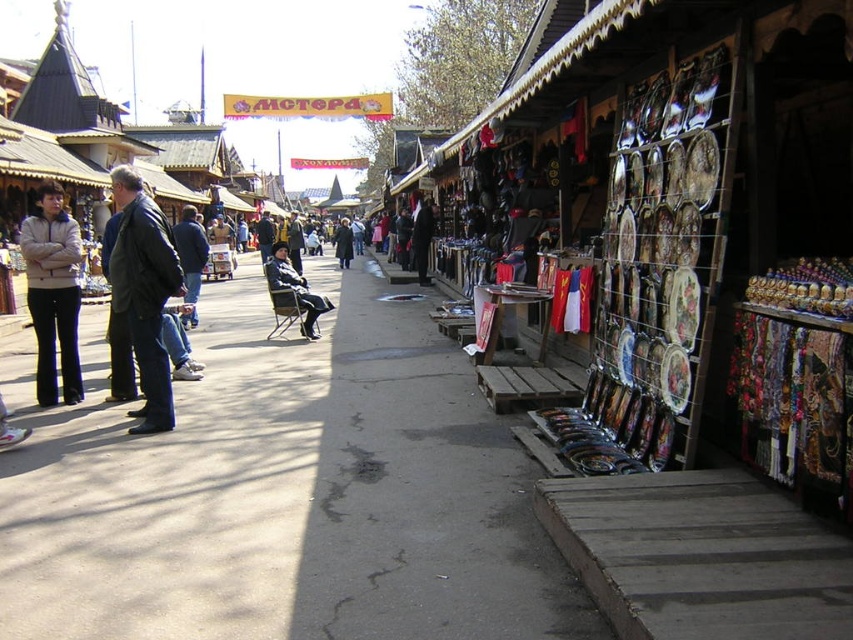
Question: Which object appears closest to the camera in this image?

Choices:
 (A) concrete sidewalk at center
 (B) matte beige jacket at left
 (C) dark gray fabric chair at center
 (D) dark blue leather jacket at left

Answer: (A)

Question: Which point is farther to the camera?

Choices:
 (A) dark green coat at center
 (B) concrete sidewalk at center
 (C) dark gray fabric chair at center

Answer: (A)

Question: Is dark blue leather jacket at left smaller than dark green coat at center?

Choices:
 (A) yes
 (B) no

Answer: (A)

Question: Is concrete sidewalk at center above dark blue leather jacket at left?

Choices:
 (A) no
 (B) yes

Answer: (A)

Question: Does dark gray fabric chair at center have a smaller size compared to dark green coat at center?

Choices:
 (A) no
 (B) yes

Answer: (B)

Question: Which object is farther from the camera taking this photo?

Choices:
 (A) matte beige jacket at left
 (B) dark blue leather jacket at left

Answer: (A)